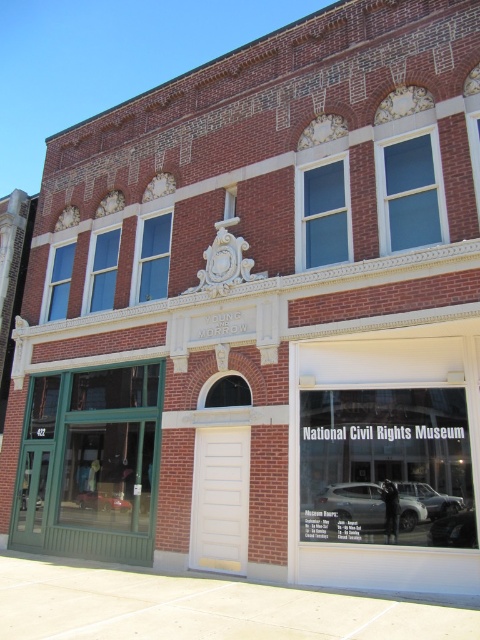
Question: Among these objects, which one is farthest from the camera?

Choices:
 (A) metallic silver car at lower right
 (B) satin silver suv at lower right
 (C) satin silver car at center

Answer: (C)

Question: Is metallic silver car at lower right smaller than metallic red car at lower left?

Choices:
 (A) yes
 (B) no

Answer: (A)

Question: Estimate the real-world distances between objects in this image. Which object is farther from the metallic red car at lower left?

Choices:
 (A) satin silver car at center
 (B) satin silver suv at lower right
 (C) metallic silver car at lower right

Answer: (C)

Question: Does satin silver car at center appear on the left side of metallic red car at lower left?

Choices:
 (A) no
 (B) yes

Answer: (A)

Question: Does satin silver car at center appear on the right side of satin silver suv at lower right?

Choices:
 (A) yes
 (B) no

Answer: (B)

Question: Estimate the real-world distances between objects in this image. Which object is farther from the satin silver car at center?

Choices:
 (A) metallic silver car at lower right
 (B) satin silver suv at lower right
 (C) metallic red car at lower left

Answer: (C)